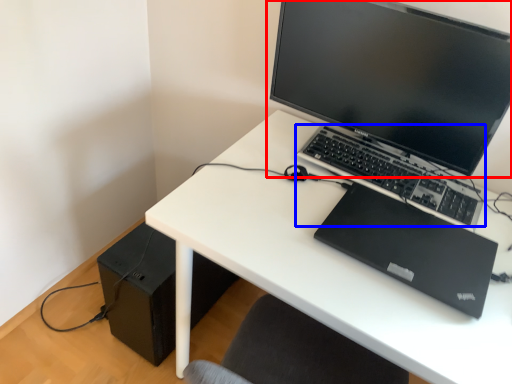
Question: Which of the following is the closest to the observer, computer monitor (highlighted by a red box) or computer keyboard (highlighted by a blue box)?

Choices:
 (A) computer monitor
 (B) computer keyboard

Answer: (A)